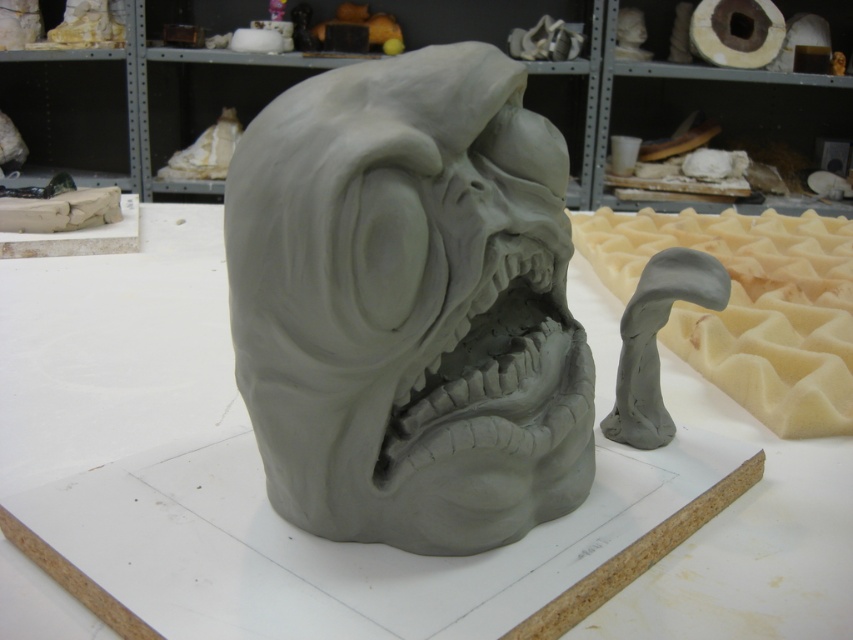
Question: Which point appears farthest from the camera in this image?

Choices:
 (A) (416, 516)
 (B) (581, 433)

Answer: (B)

Question: Does gray clay sculpture at center appear on the left side of gray clay mouth at center?

Choices:
 (A) no
 (B) yes

Answer: (B)

Question: Is gray clay sculpture at center smaller than gray clay mouth at center?

Choices:
 (A) no
 (B) yes

Answer: (A)

Question: Does gray clay sculpture at center appear under gray clay mouth at center?

Choices:
 (A) yes
 (B) no

Answer: (B)

Question: Which point is farther to the camera?

Choices:
 (A) (612, 433)
 (B) (485, 429)

Answer: (A)

Question: Which point is farther to the camera?

Choices:
 (A) (439, 346)
 (B) (567, 465)

Answer: (B)